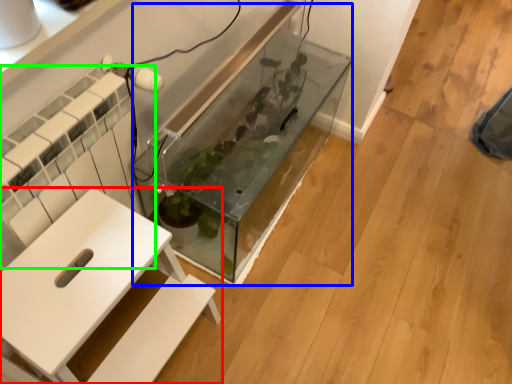
Question: Which object is positioned farthest from furniture (highlighted by a red box)? Select from glass box (highlighted by a blue box) and radiator (highlighted by a green box).

Choices:
 (A) glass box
 (B) radiator

Answer: (A)